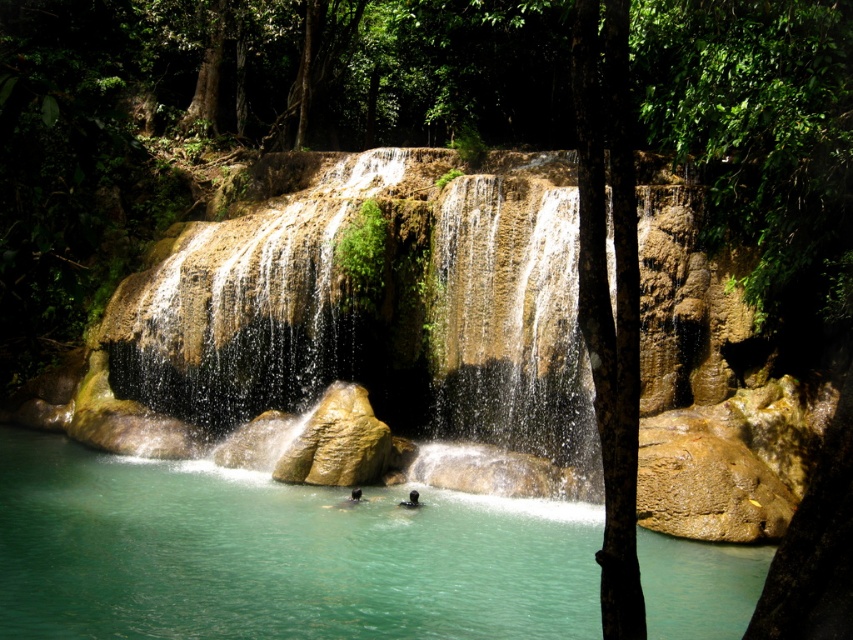
You are standing at the edge of the pool and want to reach the point marked at coordinates point [367,316]. Based on the scene description, what kind of surface will you encounter when you arrive there?

The point [367,316] is on smooth rock waterfall at center, so you will encounter a smooth rock surface there.

You are a photographer planning to take a photo of the smooth rock waterfall at center and the black matte person at center. You want to ensure the person is visible in front of the waterfall. Is the current arrangement suitable for this purpose?

The black matte person at center is behind the smooth rock waterfall at center, so the person would not be visible in front of the waterfall in the current arrangement. Adjust their position to move the person in front of the waterfall for better visibility.

You are a drone operator tasked with capturing aerial footage of the smooth rock waterfall at center. The drone must hover exactly at the coordinates provided in the Objects Description. What are the coordinates where the drone should position itself to capture the waterfall?

The smooth rock waterfall at center is located at point [367,316], so the drone should position itself at those coordinates to capture the waterfall.